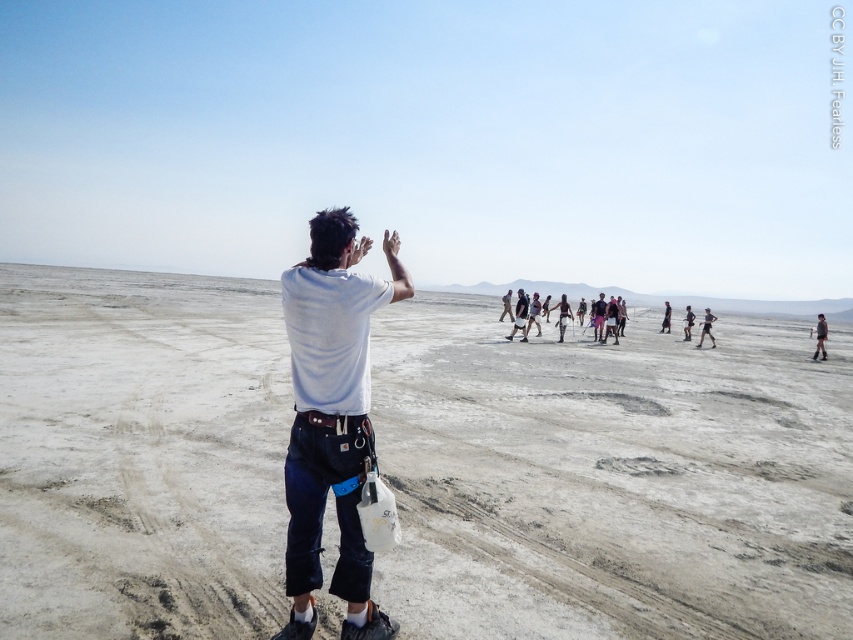
You are planning to wear the dark brown leather jacket at lower right over the black matte person at center. Will the jacket fit over the person?

The dark brown leather jacket at lower right is wider than the black matte person at center, so it should fit over them.

You are trying to decide which clothing item is wider between the light brown fabric pants at center and the black matte person at center. Which one is wider?

The black matte person at center is wider than the light brown fabric pants at center.